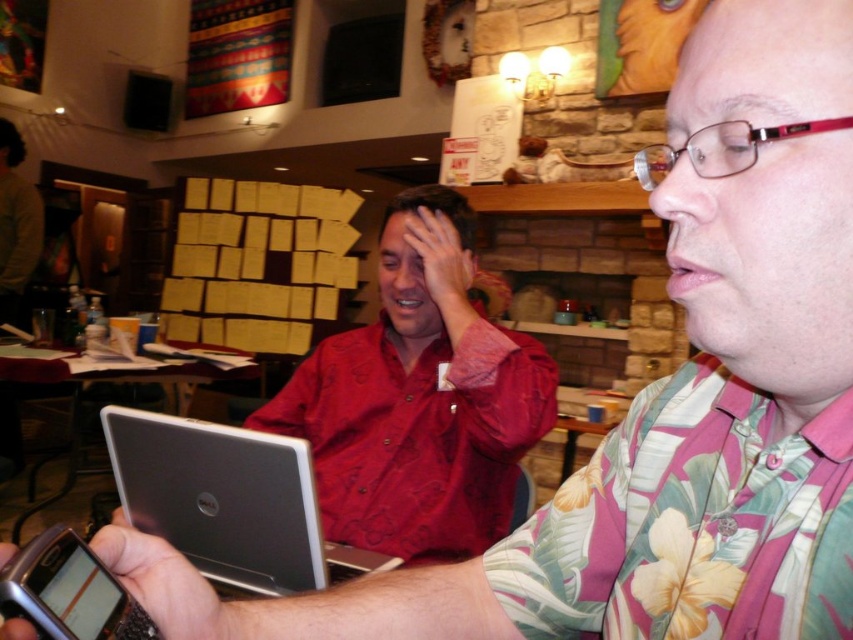
Question: Among these points, which one is farthest from the camera?

Choices:
 (A) (622, 556)
 (B) (154, 522)

Answer: (B)

Question: Considering the relative positions of matte red shirt at center and silver metallic laptop at center in the image provided, where is matte red shirt at center located with respect to silver metallic laptop at center?

Choices:
 (A) below
 (B) above

Answer: (B)

Question: Can you confirm if matte red shirt at center is positioned to the left of silver metallic laptop at center?

Choices:
 (A) yes
 (B) no

Answer: (B)

Question: Is pink floral shirt at right smaller than silver metallic laptop at center?

Choices:
 (A) no
 (B) yes

Answer: (B)

Question: Among these points, which one is nearest to the camera?

Choices:
 (A) (128, 452)
 (B) (717, 563)

Answer: (B)

Question: Which point is farther to the camera?

Choices:
 (A) (756, 532)
 (B) (466, 492)
 (C) (222, 508)

Answer: (B)